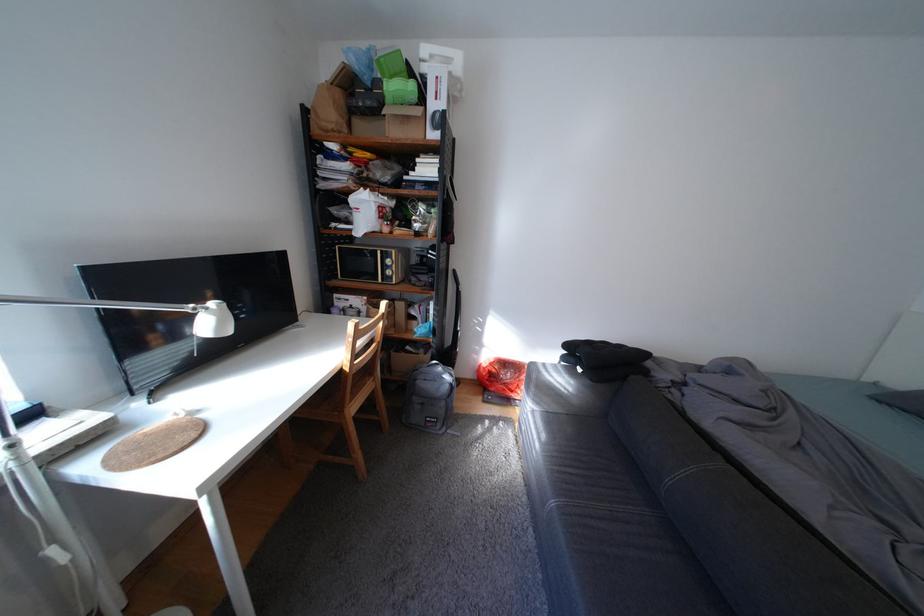
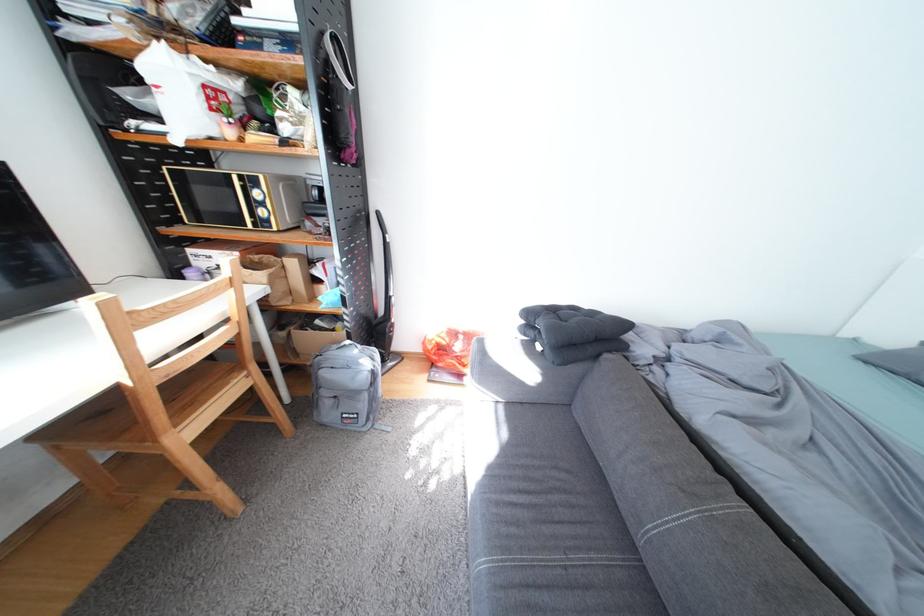
Which direction would the cameraman need to move to produce the second image?

The movement direction of the cameraman is right, forward.